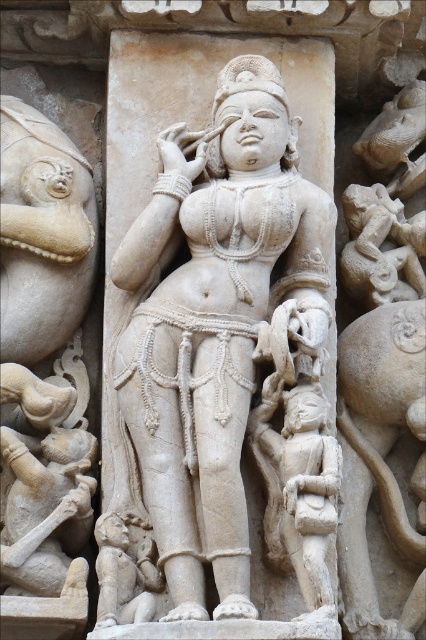
You are an archaeologist examining the stone carvings in an ancient Indian temple. You notice the white marble statue at center and the white marble child at lower left. Which of these two figures is taller?

The white marble statue at center is taller than the white marble child at lower left.

You are an archaeologist examining the stone carving of the female figure. You notice two points on the sculpture labeled as point (325,492) and point (103,598). If you were to touch both points with your fingers, which point would feel closer to your hand?

Point (325,492) is closer to the camera than point (103,598), so touching point (325,492) would feel closer to your hand.

You are an art conservator examining the stone carvings in the temple. You need to clean the white marble statue at center and the white marble child at lower left. Which object should you clean first if you want to start with the one closer to the entrance?

The white marble statue at center is in front of the white marble child at lower left, so it is closer to the entrance. You should clean the white marble statue at center first.